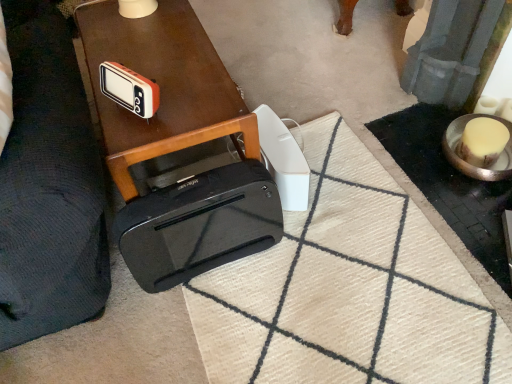
Question: From a real-world perspective, is white plastic remote control at center, positioned as the first gadget in back-to-front order, below shiny brown table at center?

Choices:
 (A) no
 (B) yes

Answer: (B)

Question: Can you confirm if white plastic remote control at center, acting as the 1th gadget starting from the right, is positioned to the right of shiny brown table at center?

Choices:
 (A) yes
 (B) no

Answer: (A)

Question: Is the depth of white plastic remote control at center, which is the 2th gadget from left to right, greater than that of shiny brown table at center?

Choices:
 (A) no
 (B) yes

Answer: (B)

Question: Is the depth of white plastic remote control at center, positioned as the first gadget in back-to-front order, less than that of shiny brown table at center?

Choices:
 (A) yes
 (B) no

Answer: (B)

Question: Are white plastic remote control at center, positioned as the first gadget in back-to-front order, and shiny brown table at center far apart?

Choices:
 (A) no
 (B) yes

Answer: (A)

Question: Considering the positions of white plastic remote control at center, positioned as the second gadget in front-to-back order, and shiny brown table at center in the image, is white plastic remote control at center, positioned as the second gadget in front-to-back order, bigger or smaller than shiny brown table at center?

Choices:
 (A) big
 (B) small

Answer: (B)

Question: From a real-world perspective, relative to shiny brown table at center, is white plastic remote control at center, positioned as the first gadget in back-to-front order, vertically above or below?

Choices:
 (A) below
 (B) above

Answer: (A)

Question: From the image's perspective, is white plastic remote control at center, acting as the 1th gadget starting from the right, above or below shiny brown table at center?

Choices:
 (A) above
 (B) below

Answer: (B)

Question: Considering the positions of white plastic remote control at center, positioned as the second gadget in front-to-back order, and shiny brown table at center in the image, is white plastic remote control at center, positioned as the second gadget in front-to-back order, taller or shorter than shiny brown table at center?

Choices:
 (A) short
 (B) tall

Answer: (A)

Question: From a real-world perspective, is shiny brown table at center above or below white plastic remote control at center, acting as the 1th gadget starting from the right?

Choices:
 (A) above
 (B) below

Answer: (A)

Question: Would you say shiny brown table at center is inside or outside white plastic remote control at center, which is the 2th gadget from left to right?

Choices:
 (A) outside
 (B) inside

Answer: (A)

Question: Looking at their shapes, would you say shiny brown table at center is wider or thinner than white plastic remote control at center, positioned as the first gadget in back-to-front order?

Choices:
 (A) thin
 (B) wide

Answer: (B)

Question: Based on their sizes in the image, would you say shiny brown table at center is bigger or smaller than white plastic remote control at center, which is the 2th gadget from left to right?

Choices:
 (A) small
 (B) big

Answer: (B)

Question: In terms of width, does orange plastic radio at upper left, placed as the second gadget when sorted from right to left, look wider or thinner when compared to shiny brown table at center?

Choices:
 (A) wide
 (B) thin

Answer: (B)

Question: From the image's perspective, relative to shiny brown table at center, is orange plastic radio at upper left, placed as the second gadget when sorted from right to left, above or below?

Choices:
 (A) above
 (B) below

Answer: (B)